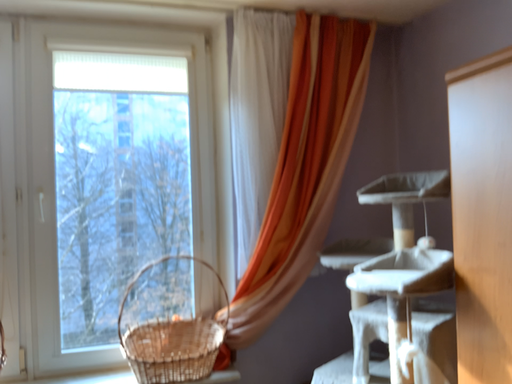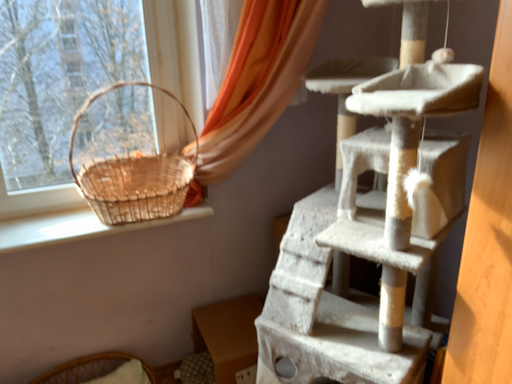
Question: Which way did the camera rotate in the video?

Choices:
 (A) rotated upward
 (B) rotated downward

Answer: (B)